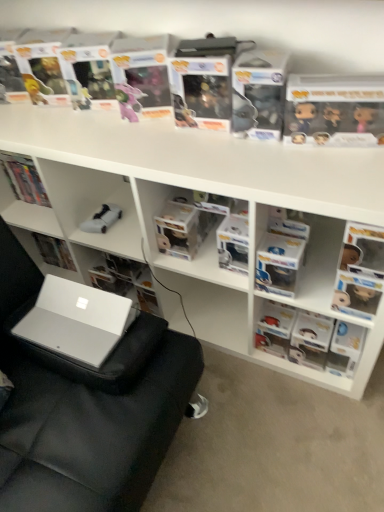
Locate an element on the screen. Image resolution: width=384 pixels, height=512 pixels. vacant space in front of matte plastic figurine at right, arranged as the 1th book when viewed from the right is located at coordinates (319, 413).